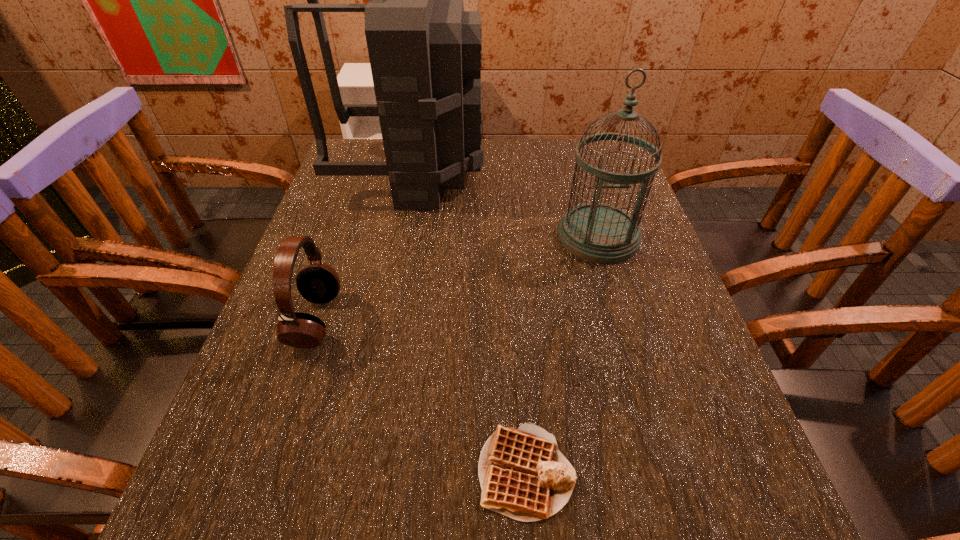
Where is `vacant space located on the left of the nearest object`? The image size is (960, 540). vacant space located on the left of the nearest object is located at coordinates (213, 470).

The width and height of the screenshot is (960, 540). Find the location of `object at the far edge`. object at the far edge is located at coordinates (425, 51).

Identify the location of object that is at the near edge. (x=523, y=475).

Identify the location of backpack located at the left edge. (425, 51).

I want to click on headset that is at the left edge, so click(319, 283).

What are the coordinates of `object present at the right edge` in the screenshot? It's located at (597, 232).

Locate an element on the screen. The width and height of the screenshot is (960, 540). object present at the far left corner is located at coordinates (425, 51).

The image size is (960, 540). What are the coordinates of `vacant space at the far edge of the desktop` in the screenshot? It's located at (501, 163).

This screenshot has width=960, height=540. I want to click on free space at the near edge of the desktop, so click(x=656, y=521).

The image size is (960, 540). In the image, there is a desktop. In order to click on vacant region at the left edge in this screenshot , I will do `click(366, 237)`.